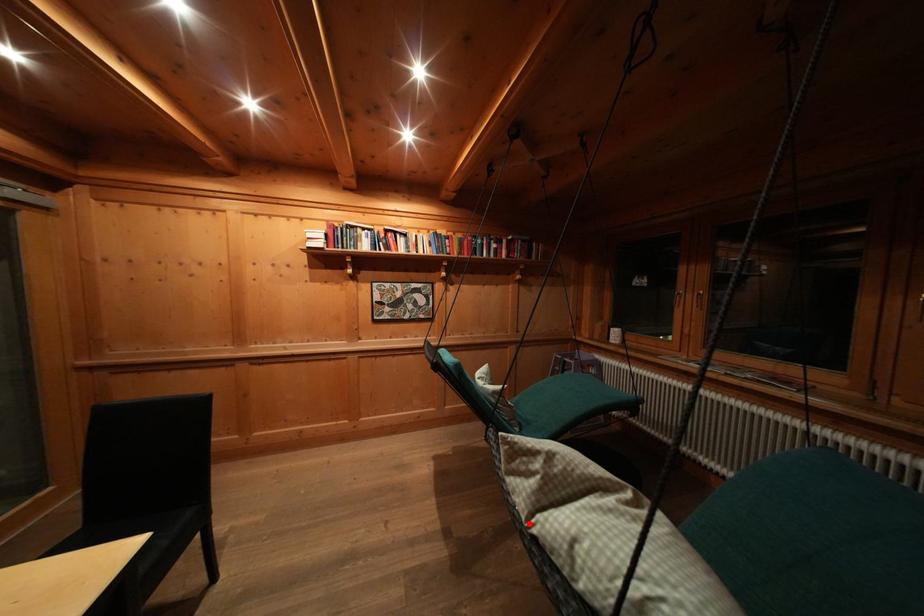
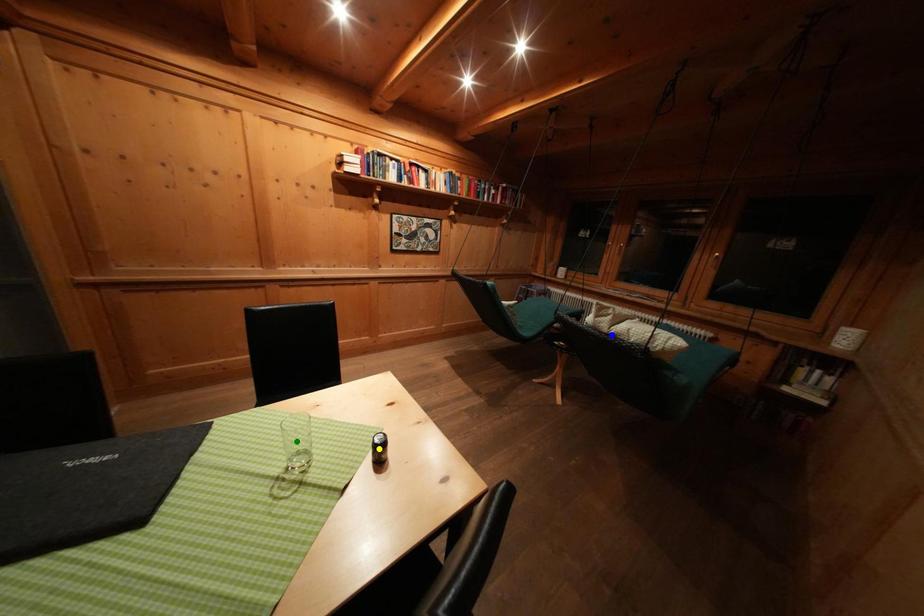
Question: I am providing you with two images of the same scene from different viewpoints. A red point is marked on the first image. You are given multiple points on the second image. Which spot in image 2 lines up with the point in image 1?

Choices:
 (A) green point
 (B) blue point
 (C) yellow point

Answer: (B)